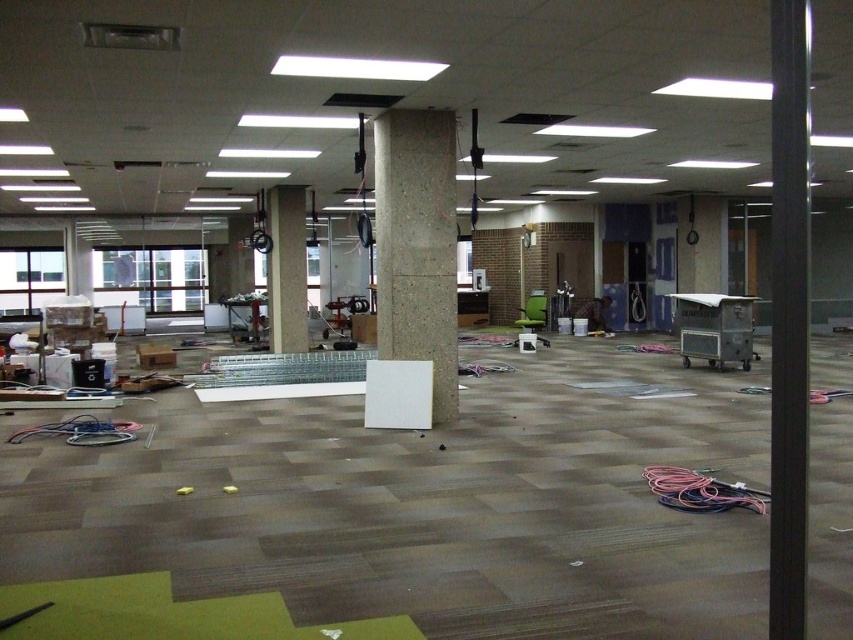
Question: Which point appears closest to the camera in this image?

Choices:
 (A) (779, 541)
 (B) (436, 275)
 (C) (293, 220)

Answer: (A)

Question: Where is concrete at center located in relation to metallic silver cart at center-right in the image?

Choices:
 (A) below
 (B) above

Answer: (B)

Question: Is the position of concrete at center less distant than that of metallic silver cart at center-right?

Choices:
 (A) no
 (B) yes

Answer: (B)

Question: Estimate the real-world distances between objects in this image. Which object is closer to the metallic silver cart at center-right?

Choices:
 (A) concrete pillar at center
 (B) black smooth pole at right
 (C) concrete at center

Answer: (B)

Question: In this image, where is concrete at center located relative to metallic silver cart at center-right?

Choices:
 (A) above
 (B) below

Answer: (A)

Question: Which point is farther to the camera?

Choices:
 (A) (679, 353)
 (B) (796, 97)

Answer: (A)